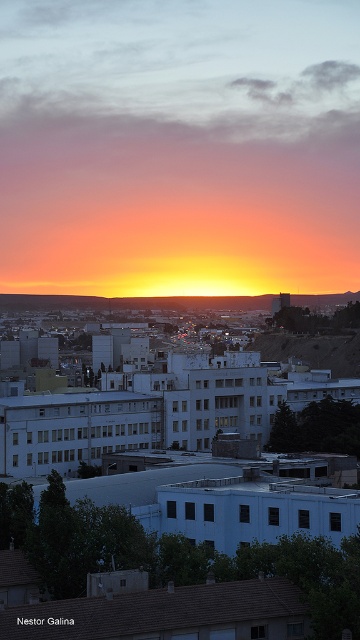
You are an architect designing a new building that needs to align with the cityscape. The building must not block the view of the sunset. Given the presence of the matte orange sky at center and the brown rocky hill at center, which object should the building avoid overshadowing to preserve the sunset view?

The matte orange sky at center is taller than the brown rocky hill at center. To preserve the sunset view, the building should avoid overshadowing the brown rocky hill at center because it is shorter and its elevation might block the view of the taller sky area.

You are an architect designing a new building that needs to align with the cityscape in the image. You notice the matte orange sky at center and the brown rocky hill at center. Which object should you place to the right side of your new building to maintain alignment with the cityscape?

You should place the brown rocky hill at center to the right side of your new building since the matte orange sky at center is already positioned to the left of the brown rocky hill at center in the existing cityscape.